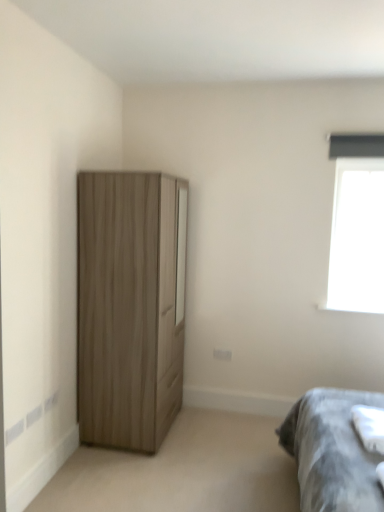
This screenshot has width=384, height=512. Identify the location of blank space above transparent glass window at upper right (from a real-world perspective). (360, 161).